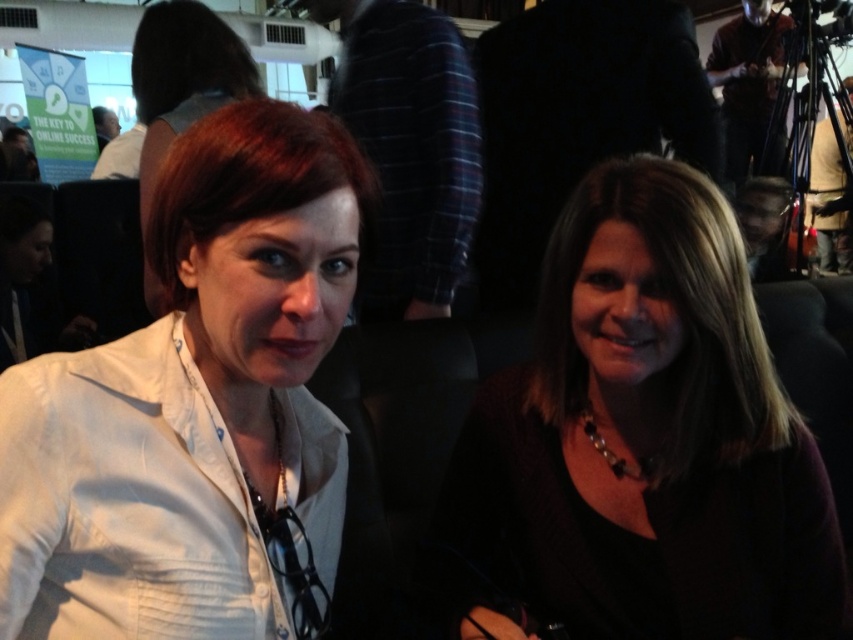
Which is more to the left, dark brown hair at center or matte white shirt at center?

matte white shirt at center is more to the left.

Is dark brown hair at center closer to the viewer compared to matte white shirt at center?

No, dark brown hair at center is behind matte white shirt at center.

Does point (625, 170) come behind point (189, 67)?

That is False.

You are a GUI agent. You are given a task and a screenshot of the screen. Output one action in this format:
    pyautogui.click(x=<x>, y=<y>)
    Task: Click on the dark brown hair at center
    This screenshot has height=640, width=853.
    Given the screenshot: What is the action you would take?
    pyautogui.click(x=648, y=435)

Does white matte blazer at center have a lesser width compared to dark brown hair at center?

Yes, white matte blazer at center is thinner than dark brown hair at center.

Consider the image. Is white matte blazer at center shorter than dark brown hair at center?

Yes.

Who is more forward, (x=286, y=371) or (x=549, y=305)?

Point (x=286, y=371) is in front.

At what (x,y) coordinates should I click in order to perform the action: click on white matte blazer at center. Please return your answer as a coordinate pair (x, y). The height and width of the screenshot is (640, 853). Looking at the image, I should click on (192, 401).

Is point (155, 420) positioned behind point (158, 97)?

No, it is not.

This screenshot has height=640, width=853. Describe the element at coordinates (192, 401) in the screenshot. I see `white matte blazer at center` at that location.

Find the location of a particular element. This screenshot has width=853, height=640. white matte blazer at center is located at coordinates (192, 401).